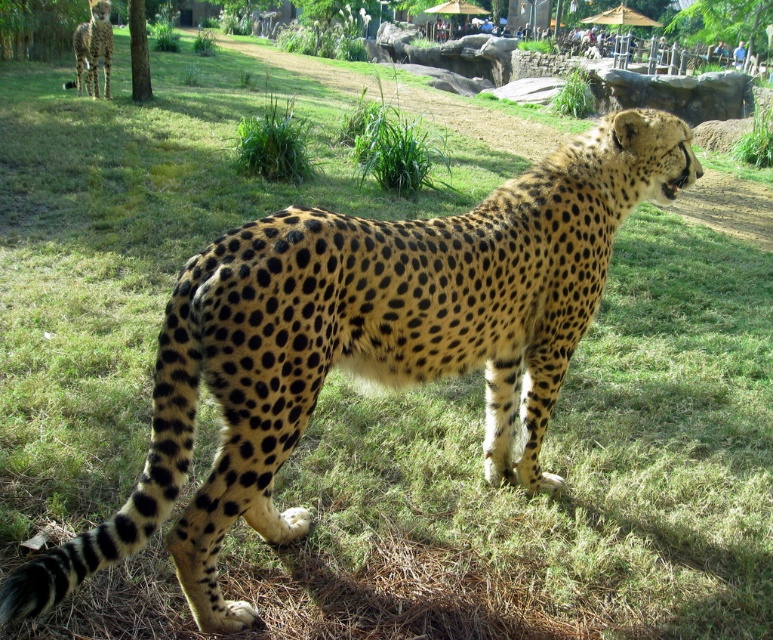
Question: Which point is closer to the camera taking this photo?

Choices:
 (A) (80, 61)
 (B) (138, 68)

Answer: (B)

Question: Which point appears closest to the camera in this image?

Choices:
 (A) (709, 36)
 (B) (104, 1)
 (C) (147, 68)

Answer: (C)

Question: Does spotted fur cheetah at upper left come behind green leafy tree at upper left?

Choices:
 (A) yes
 (B) no

Answer: (A)

Question: Does green leafy tree at upper center appear over spotted fur cheetah at upper left?

Choices:
 (A) no
 (B) yes

Answer: (B)

Question: Based on their relative distances, which object is farther from the green leafy tree at upper center?

Choices:
 (A) spotted fur cheetah at upper left
 (B) green leafy tree at upper left

Answer: (A)

Question: Can you confirm if spotted fur cheetah at upper left is positioned below green leafy tree at upper left?

Choices:
 (A) no
 (B) yes

Answer: (A)